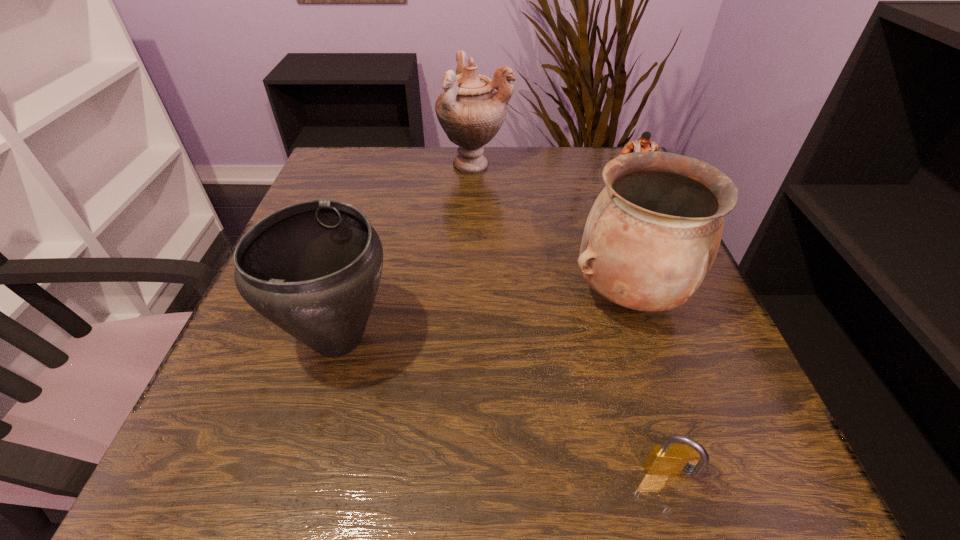
Find the location of a particular element. Image resolution: width=960 pixels, height=540 pixels. object that is at the near right corner is located at coordinates (668, 459).

This screenshot has height=540, width=960. Identify the location of vacant region at the far edge of the desktop. (503, 197).

Image resolution: width=960 pixels, height=540 pixels. I want to click on vacant space at the near edge, so click(x=603, y=449).

You are a GUI agent. You are given a task and a screenshot of the screen. Output one action in this format:
    pyautogui.click(x=<x>, y=<y>)
    Task: Click on the free spot at the left edge of the desktop
    Image resolution: width=960 pixels, height=540 pixels.
    Given the screenshot: What is the action you would take?
    pyautogui.click(x=292, y=371)

Find the location of a particular element. free space at the right edge of the desktop is located at coordinates (734, 365).

The height and width of the screenshot is (540, 960). In order to click on vacant space at the far left corner of the desktop in this screenshot , I will do `click(353, 153)`.

The height and width of the screenshot is (540, 960). In the image, there is a desktop. In order to click on free space at the near left corner in this screenshot , I will do `click(303, 450)`.

The width and height of the screenshot is (960, 540). What are the coordinates of `vacant space at the far right corner of the desktop` in the screenshot? It's located at (597, 154).

Image resolution: width=960 pixels, height=540 pixels. I want to click on free space between the leftmost object and the shortest object, so click(505, 407).

At what (x,y) coordinates should I click in order to perform the action: click on free space between the second urn from right to left and the leftmost object. Please return your answer as a coordinate pair (x, y). The height and width of the screenshot is (540, 960). Looking at the image, I should click on (407, 251).